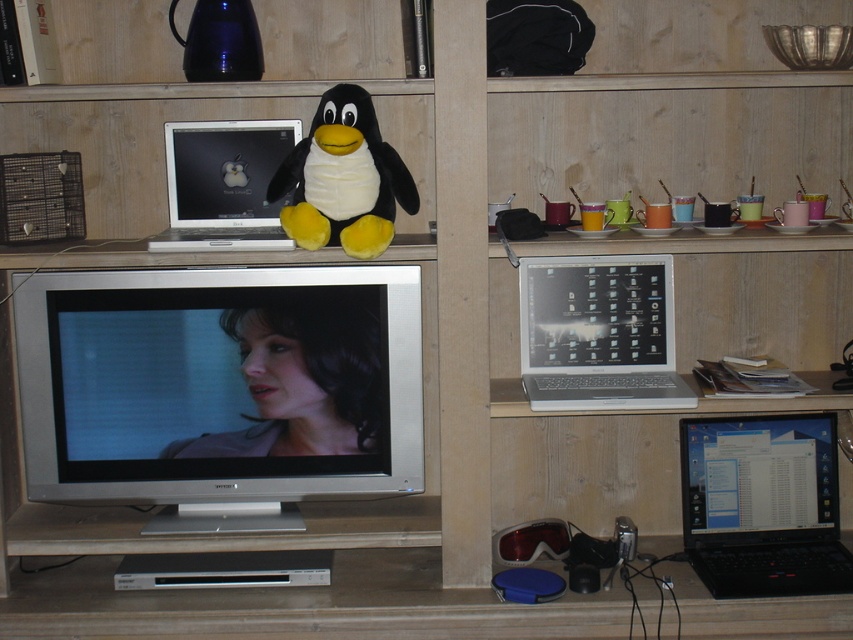
Question: Which point appears farthest from the camera in this image?

Choices:
 (A) (833, 444)
 (B) (229, 385)

Answer: (A)

Question: Is smooth skin face at center above white soft plush penguin at center?

Choices:
 (A) yes
 (B) no

Answer: (B)

Question: Which point is farther from the camera taking this photo?

Choices:
 (A) (184, 179)
 (B) (728, 554)
 (C) (630, 365)
 (D) (341, 337)

Answer: (C)

Question: Does silver metallic television at center appear under silver metallic laptop at center right?

Choices:
 (A) no
 (B) yes

Answer: (B)

Question: Can you confirm if silver metallic television at center is wider than black glossy laptop at lower right?

Choices:
 (A) yes
 (B) no

Answer: (A)

Question: Which point is farther to the camera?

Choices:
 (A) black glossy laptop at lower right
 (B) white soft plush penguin at center

Answer: (A)